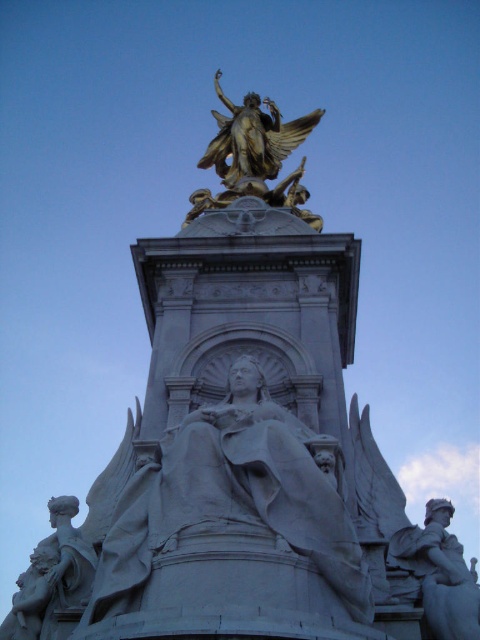
Looking at this image, between white marble statue at lower right and white marble statue at lower left, which one appears on the right side from the viewer's perspective?

white marble statue at lower right

Between point (435, 552) and point (66, 579), which one is positioned in front?

Point (435, 552) is more forward.

From the picture: Who is more forward, [433,593] or [67,520]?

Positioned in front is point [433,593].

Where is `white marble statue at lower right`? The width and height of the screenshot is (480, 640). white marble statue at lower right is located at coordinates (440, 572).

Does gold/gilded statue at upper center have a greater width compared to white marble statue at lower left?

Yes.

Looking at this image, who is lower down, gold/gilded statue at upper center or white marble statue at lower left?

white marble statue at lower left

Does point (243, 129) come in front of point (27, 604)?

No, it is not.

Locate an element on the screen. gold/gilded statue at upper center is located at coordinates (254, 156).

Where is `gold/gilded statue at upper center`? The height and width of the screenshot is (640, 480). gold/gilded statue at upper center is located at coordinates 254,156.

Is point (236, 160) less distant than point (472, 570)?

No, it is behind (472, 570).

Does point (284, 147) come closer to viewer compared to point (434, 577)?

No.

Identify the location of gold/gilded statue at upper center. (254, 156).